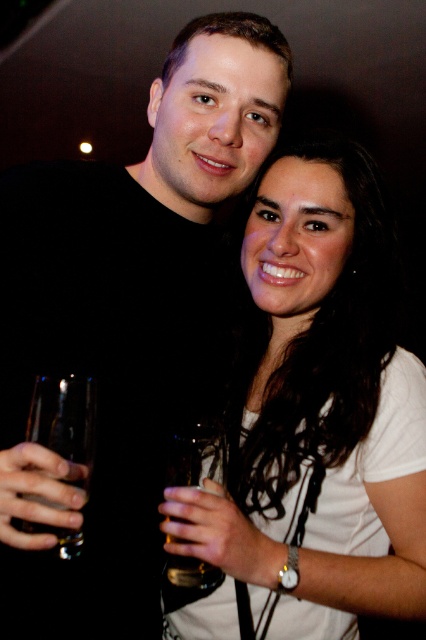
You are at a party and want to place a small note on the table between the white matte shirt at center and the translucent glass at center. Which object should you place the note closer to to ensure it doesn

The white matte shirt at center has a larger size compared to the translucent glass at center, so placing the note closer to the translucent glass at center would leave more space between the shirt and the note.

You are at a party and want to take a photo of the white matte shirt at center and the translucent glass at center. Which object should you focus on first if you want to capture both clearly in your camera frame?

You should focus on the white matte shirt at center first because it is positioned to the right of the translucent glass at center, so adjusting focus to the shirt ensures both are in frame.